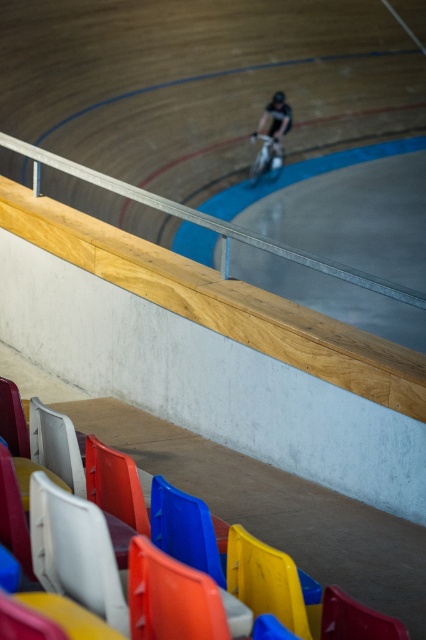
You are a spectator sitting in the tiered seating area. You want to take a photo of the black matte bicycle at center. Where should you aim your camera to capture it?

You should aim your camera at the coordinates point [271,138] to capture the black matte bicycle at center.